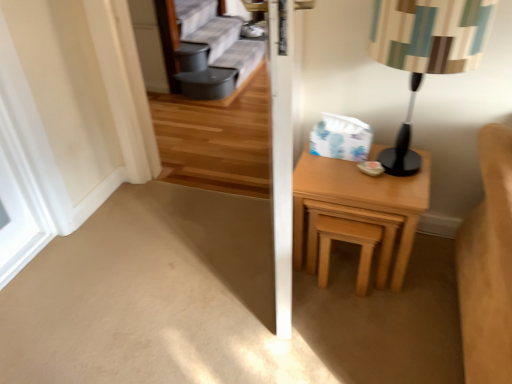
The height and width of the screenshot is (384, 512). Describe the element at coordinates (361, 198) in the screenshot. I see `light wood/texture nightstand at right` at that location.

Describe the element at coordinates (25, 171) in the screenshot. I see `white matte window at left` at that location.

Identify the location of light wood/texture nightstand at right. This screenshot has height=384, width=512. (361, 198).

From the picture: From the image's perspective, which object appears higher, white matte window at left or striped fabric lampshade at right?

striped fabric lampshade at right, from the image's perspective.

Can you tell me how much white matte window at left and striped fabric lampshade at right differ in facing direction?

They differ by 89.6 degrees in their facing directions.

Is white matte window at left oriented away from striped fabric lampshade at right?

No.

Consider the image. Relative to striped fabric lampshade at right, is white matte window at left in front or behind?

Visually, white matte window at left is located behind striped fabric lampshade at right.

Between light brown wooden stool at right and light wood/texture nightstand at right, which one has larger width?

With larger width is light wood/texture nightstand at right.

Is light brown wooden stool at right placed right next to light wood/texture nightstand at right?

There is a gap between light brown wooden stool at right and light wood/texture nightstand at right.

Where is `stool beneath the light wood/texture nightstand at right (from a real-world perspective)`? The width and height of the screenshot is (512, 384). stool beneath the light wood/texture nightstand at right (from a real-world perspective) is located at coordinates (349, 242).

How many degrees apart are the facing directions of light brown wooden stool at right and light wood/texture nightstand at right?

The facing directions of light brown wooden stool at right and light wood/texture nightstand at right are 3.67e-05 degrees apart.

Is striped fabric lampshade at right positioned with its back to light wood/texture nightstand at right?

No, striped fabric lampshade at right's orientation is not away from light wood/texture nightstand at right.

From a real-world perspective, is striped fabric lampshade at right over light wood/texture nightstand at right?

Yes, from a real-world perspective, striped fabric lampshade at right is over light wood/texture nightstand at right

Does point (391, 163) come in front of point (327, 200)?

That is False.

Locate an element on the screen. The height and width of the screenshot is (384, 512). window on the left of light brown wooden stool at right is located at coordinates point(25,171).

In the scene shown: Can you confirm if white matte window at left is taller than light brown wooden stool at right?

Yes, white matte window at left is taller than light brown wooden stool at right.

Can light brown wooden stool at right be found inside white matte window at left?

No.

Which is more to the right, white matte window at left or light brown wooden stool at right?

From the viewer's perspective, light brown wooden stool at right appears more on the right side.

From the image's perspective, is light brown wooden stool at right positioned above or below striped fabric lampshade at right?

From the image's perspective, light brown wooden stool at right appears below striped fabric lampshade at right.

Is point (322, 260) positioned behind point (442, 39)?

That is True.

Is light brown wooden stool at right spatially inside striped fabric lampshade at right, or outside of it?

light brown wooden stool at right cannot be found inside striped fabric lampshade at right.

Is light brown wooden stool at right in front of white matte window at left?

That is False.

How much distance is there between light brown wooden stool at right and white matte window at left?

They are 1.33 meters apart.

Is light brown wooden stool at right far from white matte window at left?

light brown wooden stool at right is far away from white matte window at left.

Could you tell me if light brown wooden stool at right is facing white matte window at left?

No, light brown wooden stool at right is not oriented towards white matte window at left.

Does striped fabric lampshade at right appear on the left side of white matte window at left?

In fact, striped fabric lampshade at right is to the right of white matte window at left.

Is striped fabric lampshade at right facing away from white matte window at left?

That's not correct — striped fabric lampshade at right is not looking away from white matte window at left.

Considering the sizes of objects striped fabric lampshade at right and white matte window at left in the image provided, who is smaller, striped fabric lampshade at right or white matte window at left?

white matte window at left.

Is striped fabric lampshade at right further to the viewer compared to white matte window at left?

No, it is not.

There is a white matte window at left. Identify the location of table lamp above it (from a real-world perspective). This screenshot has height=384, width=512. (425, 52).

Locate an element on the screen. nightstand on the right of light brown wooden stool at right is located at coordinates (361, 198).

Which object lies further to the anchor point striped fabric lampshade at right, light brown wooden stool at right or white matte window at left?

Among the two, white matte window at left is located further to striped fabric lampshade at right.

Based on the photo, looking at the image, which one is located further to light brown wooden stool at right, light wood/texture nightstand at right or white matte window at left?

white matte window at left is positioned further to the anchor light brown wooden stool at right.

Estimate the real-world distances between objects in this image. Which object is further from light wood/texture nightstand at right, white matte window at left or striped fabric lampshade at right?

white matte window at left is further to light wood/texture nightstand at right.

Which object lies further to the anchor point white matte window at left, striped fabric lampshade at right or light brown wooden stool at right?

striped fabric lampshade at right is further to white matte window at left.

Estimate the real-world distances between objects in this image. Which object is further from white matte window at left, light wood/texture nightstand at right or striped fabric lampshade at right?

Based on the image, striped fabric lampshade at right appears to be further to white matte window at left.

Estimate the real-world distances between objects in this image. Which object is closer to light brown wooden stool at right, white matte window at left or striped fabric lampshade at right?

Based on the image, striped fabric lampshade at right appears to be nearer to light brown wooden stool at right.

From the image, which object appears to be nearer to light brown wooden stool at right, light wood/texture nightstand at right or striped fabric lampshade at right?

light wood/texture nightstand at right is closer to light brown wooden stool at right.

Which object lies further to the anchor point light wood/texture nightstand at right, white matte window at left or light brown wooden stool at right?

white matte window at left.

Find the location of a particular element. nightstand between striped fabric lampshade at right and light brown wooden stool at right vertically is located at coordinates (361, 198).

Where is `stool between white matte window at left and light wood/texture nightstand at right in the horizontal direction`? The height and width of the screenshot is (384, 512). stool between white matte window at left and light wood/texture nightstand at right in the horizontal direction is located at coordinates (349, 242).

You are a GUI agent. You are given a task and a screenshot of the screen. Output one action in this format:
    pyautogui.click(x=<x>, y=<y>)
    Task: Click on the nightstand between white matte window at left and striped fabric lampshade at right
    This screenshot has width=512, height=384.
    Given the screenshot: What is the action you would take?
    pyautogui.click(x=361, y=198)

Find the location of a particular element. stool between white matte window at left and striped fabric lampshade at right is located at coordinates (349, 242).